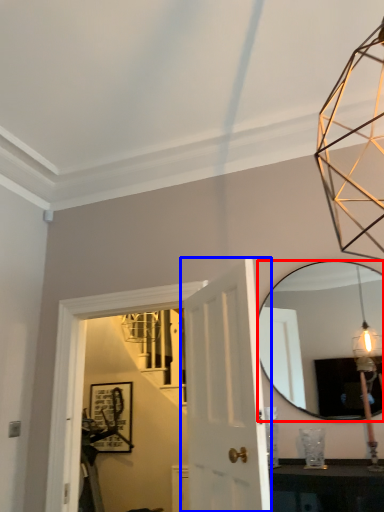
Question: Which of the following is the closest to the observer, mirror (highlighted by a red box) or door (highlighted by a blue box)?

Choices:
 (A) mirror
 (B) door

Answer: (B)